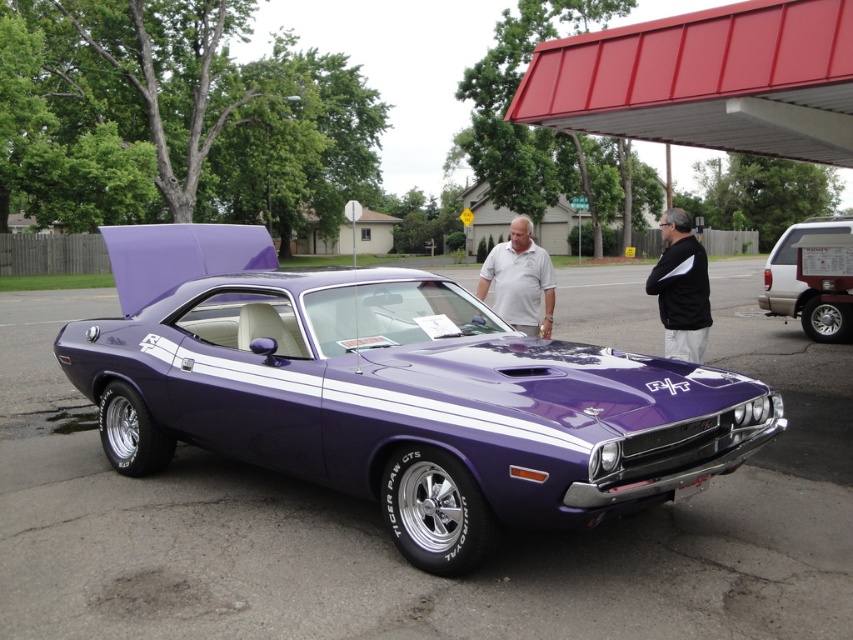
Who is higher up, purple glossy muscle car at center or maroon matte suv at right?

maroon matte suv at right is higher up.

Which of these two, purple glossy muscle car at center or maroon matte suv at right, stands taller?

purple glossy muscle car at center is taller.

Where is `purple glossy muscle car at center`? purple glossy muscle car at center is located at coordinates (393, 392).

Identify the location of purple glossy muscle car at center. (393, 392).

The height and width of the screenshot is (640, 853). What are the coordinates of `maroon matte suv at right` in the screenshot? It's located at (805, 284).

Is point (819, 225) in front of point (531, 298)?

No, it is behind (531, 298).

Between point (815, 227) and point (531, 326), which one is positioned behind?

Positioned behind is point (815, 227).

I want to click on maroon matte suv at right, so click(805, 284).

Can you confirm if purple glossy muscle car at center is bigger than white smooth shirt at center?

Incorrect, purple glossy muscle car at center is not larger than white smooth shirt at center.

Which is behind, point (316, 429) or point (527, 292)?

Point (527, 292)

Find the location of a particular element. The width and height of the screenshot is (853, 640). purple glossy muscle car at center is located at coordinates (393, 392).